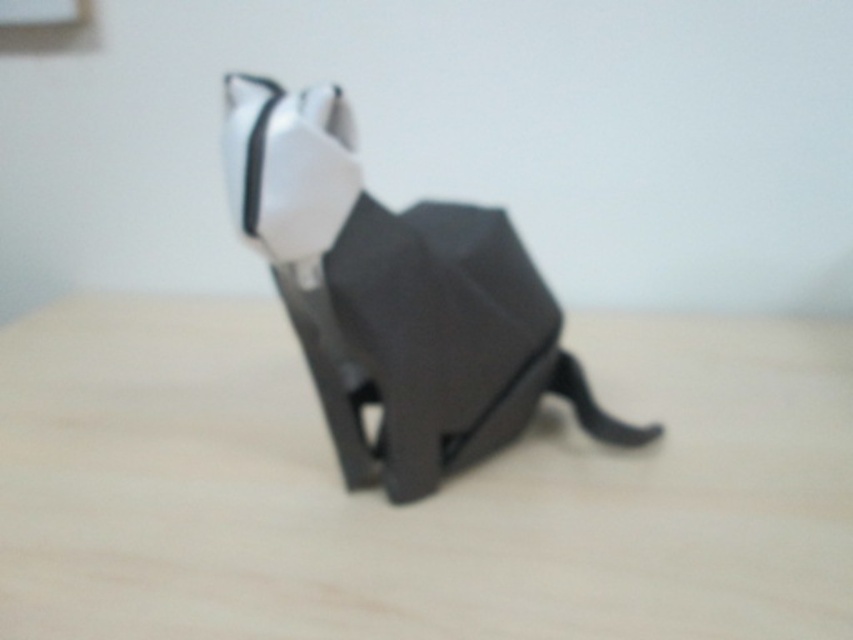
Does wooden table at center come behind white matte bow tie at center?

That is True.

Can you confirm if wooden table at center is positioned to the left of white matte bow tie at center?

Indeed, wooden table at center is positioned on the left side of white matte bow tie at center.

Identify the location of wooden table at center. The image size is (853, 640). pos(422,500).

Identify the location of wooden table at center. (422, 500).